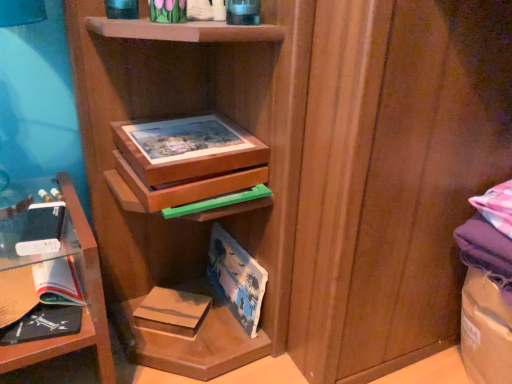
Question: From the image's perspective, is clear glass shelf at left located above wooden puzzle box at center?

Choices:
 (A) no
 (B) yes

Answer: (A)

Question: Does clear glass shelf at left have a smaller size compared to wooden puzzle box at center?

Choices:
 (A) no
 (B) yes

Answer: (A)

Question: Considering the relative sizes of clear glass shelf at left and wooden puzzle box at center in the image provided, is clear glass shelf at left bigger than wooden puzzle box at center?

Choices:
 (A) no
 (B) yes

Answer: (B)

Question: From the image's perspective, is clear glass shelf at left below wooden puzzle box at center?

Choices:
 (A) no
 (B) yes

Answer: (B)

Question: Does clear glass shelf at left have a lesser width compared to wooden puzzle box at center?

Choices:
 (A) no
 (B) yes

Answer: (A)

Question: Would you say clear glass shelf at left contains wooden puzzle box at center?

Choices:
 (A) yes
 (B) no

Answer: (B)

Question: Would you say white glossy paperback book at lower left, the 1th paperback book in the left-to-right sequence, contains matte paper paperback book at center, the first paperback book in the right-to-left sequence?

Choices:
 (A) no
 (B) yes

Answer: (A)

Question: From a real-world perspective, is white glossy paperback book at lower left, which is counted as the 3th paperback book, starting from the right, under matte paper paperback book at center, arranged as the third paperback book when viewed from the left?

Choices:
 (A) yes
 (B) no

Answer: (B)

Question: Is white glossy paperback book at lower left, the 1th paperback book in the left-to-right sequence, at the left side of matte paper paperback book at center, arranged as the third paperback book when viewed from the left?

Choices:
 (A) no
 (B) yes

Answer: (B)

Question: Considering the relative sizes of white glossy paperback book at lower left, which is counted as the 3th paperback book, starting from the right, and matte paper paperback book at center, arranged as the third paperback book when viewed from the left, in the image provided, is white glossy paperback book at lower left, which is counted as the 3th paperback book, starting from the right, thinner than matte paper paperback book at center, arranged as the third paperback book when viewed from the left,?

Choices:
 (A) yes
 (B) no

Answer: (B)

Question: Is white glossy paperback book at lower left, which is counted as the 3th paperback book, starting from the right, oriented away from matte paper paperback book at center, the first paperback book in the right-to-left sequence?

Choices:
 (A) yes
 (B) no

Answer: (B)

Question: From the image's perspective, would you say white glossy paperback book at lower left, the 1th paperback book in the left-to-right sequence, is positioned over matte paper paperback book at center, the first paperback book in the right-to-left sequence?

Choices:
 (A) yes
 (B) no

Answer: (A)

Question: From the image's perspective, is matte paper paperback book at center, the first paperback book in the right-to-left sequence, below clear glass shelf at left?

Choices:
 (A) no
 (B) yes

Answer: (B)